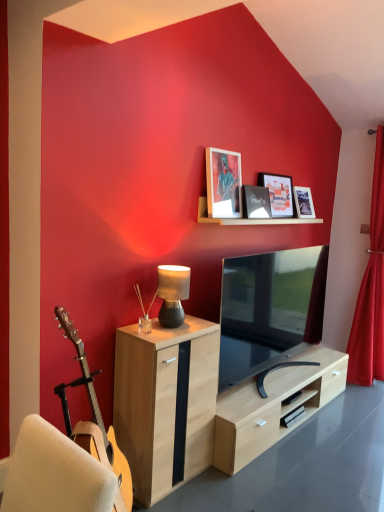
Question: Considering the relative sizes of matte black lamp at center and matte black tv at center in the image provided, is matte black lamp at center smaller than matte black tv at center?

Choices:
 (A) yes
 (B) no

Answer: (A)

Question: From a real-world perspective, does matte black lamp at center sit lower than matte black tv at center?

Choices:
 (A) no
 (B) yes

Answer: (A)

Question: Is matte black lamp at center next to matte black tv at center and touching it?

Choices:
 (A) yes
 (B) no

Answer: (B)

Question: Can you confirm if matte black lamp at center is wider than matte black tv at center?

Choices:
 (A) yes
 (B) no

Answer: (B)

Question: Would you say matte black lamp at center is a long distance from matte black tv at center?

Choices:
 (A) yes
 (B) no

Answer: (B)

Question: Is point (225, 174) closer or farther from the camera than point (309, 215)?

Choices:
 (A) closer
 (B) farther

Answer: (A)

Question: Is matte glass picture frame at upper center, placed as the first picture frame when sorted from left to right, spatially inside matte black picture frame at upper right, the 1th picture frame from the right, or outside of it?

Choices:
 (A) outside
 (B) inside

Answer: (A)

Question: From a real-world perspective, is matte glass picture frame at upper center, arranged as the 4th picture frame when viewed from the right, above or below matte black picture frame at upper right, the 4th picture frame in the left-to-right sequence?

Choices:
 (A) below
 (B) above

Answer: (B)

Question: Is matte glass picture frame at upper center, placed as the first picture frame when sorted from left to right, to the left or to the right of matte black picture frame at upper right, the 1th picture frame from the right, in the image?

Choices:
 (A) right
 (B) left

Answer: (B)

Question: Considering the positions of point (246, 271) and point (251, 210), is point (246, 271) closer or farther from the camera than point (251, 210)?

Choices:
 (A) farther
 (B) closer

Answer: (B)

Question: In the image, is matte black tv at center positioned in front of or behind matte black picture frame at upper center, which is the 3th picture frame in right-to-left order?

Choices:
 (A) front
 (B) behind

Answer: (A)

Question: Choose the correct answer: Is matte black tv at center inside matte black picture frame at upper center, marked as the 2th picture frame in a left-to-right arrangement, or outside it?

Choices:
 (A) inside
 (B) outside

Answer: (B)

Question: From a real-world perspective, is matte black tv at center physically located above or below matte black picture frame at upper center, marked as the 2th picture frame in a left-to-right arrangement?

Choices:
 (A) below
 (B) above

Answer: (A)

Question: Considering the positions of light wood cabinet at center and red velvet curtain at right in the image, is light wood cabinet at center wider or thinner than red velvet curtain at right?

Choices:
 (A) thin
 (B) wide

Answer: (B)

Question: Would you say light wood cabinet at center is inside or outside red velvet curtain at right?

Choices:
 (A) inside
 (B) outside

Answer: (B)